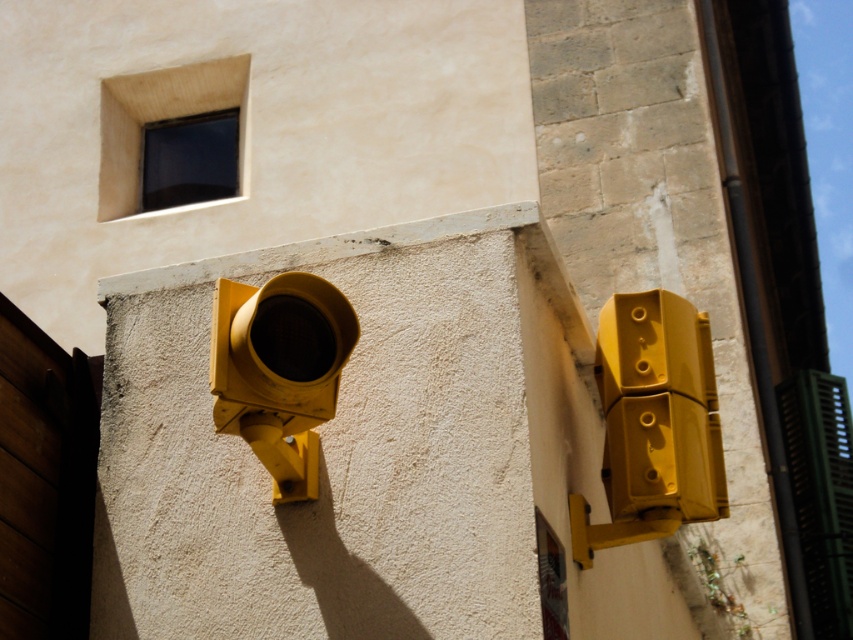
You are a delivery drone flying towards the beige wall with two yellow pedestrian crossing lights. You need to land precisely at the matte yellow traffic light at right. According to the coordinates provided, where should you aim your landing? Please provide the coordinates in the format of a point like this example format for clarity and precision.

The matte yellow traffic light at right is located at point coordinates of 0.662 in the x axis and 0.767 in the y axis. So you should aim your landing at point coordinates of x equals 0.662 and y equals 0.767.

You are a delivery drone flying towards the beige wall with two yellow pedestrian crossing lights. You need to determine which of the two points, point (610, 465) or point (300, 400), is closer to you as you approach the wall. Which point is closer?

Point (610, 465) is further to the viewer than point (300, 400), so the closer point to you is point (300, 400).

You are a maintenance worker checking the matte yellow traffic light at right and the matte yellow traffic light at left mounted on a wall. Which traffic light is taller?

The matte yellow traffic light at right has a greater height compared to the matte yellow traffic light at left, so the matte yellow traffic light at right is taller.